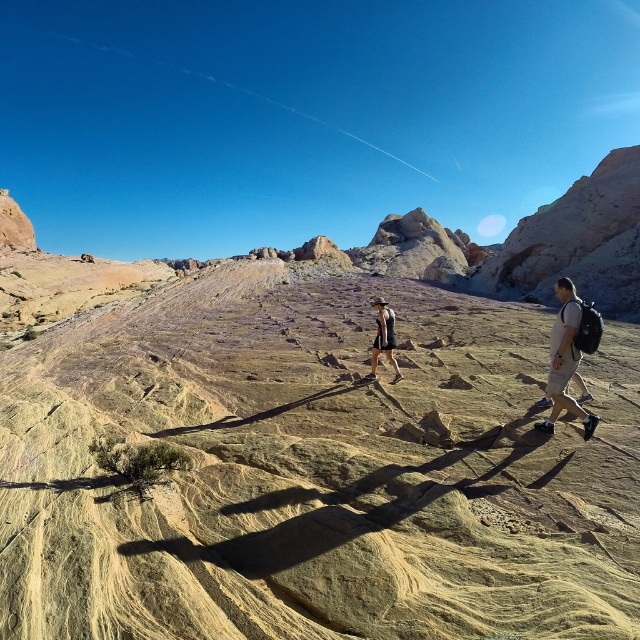
You are a hiker planning to carry both the light brown canvas backpack at right and the matte black shorts at center. Since you have a limited space in your pack, which item can you fit first based on their sizes?

The light brown canvas backpack at right has a smaller width than the matte black shorts at center, so you can fit the light brown canvas backpack at right first into your limited space.

You are standing in the desert and see two points marked on the ground. The first point is labeled as point (561, 364) and the second is point (381, 316). Which point is closer to you?

Point (561, 364) is closer to the viewer than point (381, 316).

You are planning to place a 30 cm tall cactus between the light brown canvas backpack at right and the matte black shorts at center. Based on their heights, will the cactus be visible above both objects?

The light brown canvas backpack at right is shorter than the matte black shorts at center. Since the cactus is 30 cm tall, it will only be visible above the light brown canvas backpack at right but not the matte black shorts at center if the shorts are taller than 30 cm.